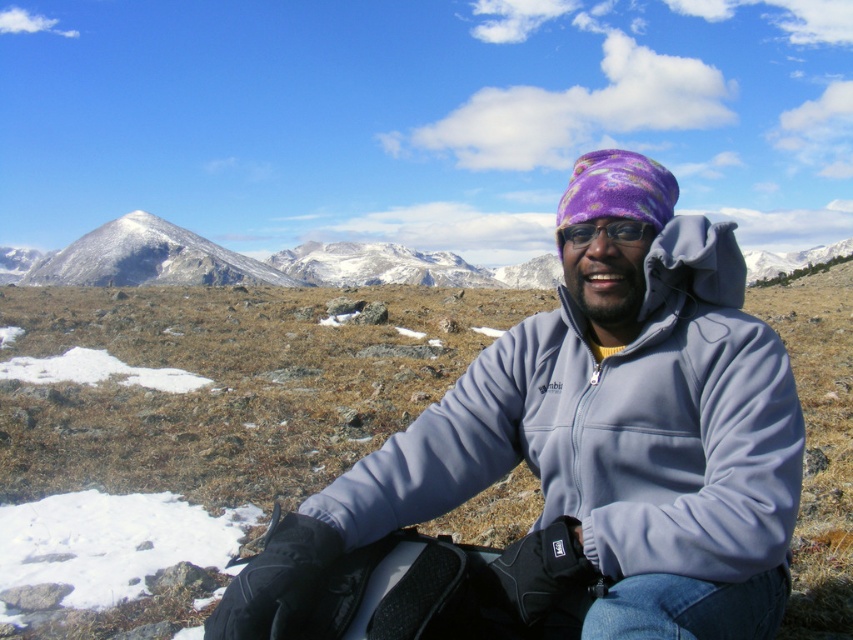
Where is `gray fleece jacket at center`? The height and width of the screenshot is (640, 853). gray fleece jacket at center is located at coordinates (614, 428).

Does gray fleece jacket at center have a greater width compared to purple fleece goggles at center?

Yes, gray fleece jacket at center is wider than purple fleece goggles at center.

Locate an element on the screen. The height and width of the screenshot is (640, 853). gray fleece jacket at center is located at coordinates (614, 428).

Between gray fleece jacket at center and snowy rock mountain at left, which one appears on the right side from the viewer's perspective?

gray fleece jacket at center is more to the right.

Which is behind, point (616, 426) or point (190, 240)?

Positioned behind is point (190, 240).

Where is `gray fleece jacket at center`? The image size is (853, 640). gray fleece jacket at center is located at coordinates (614, 428).

Between point (224, 256) and point (578, 225), which one is positioned in front?

Point (578, 225) is in front.

Who is taller, snowy rock mountain at left or purple fleece goggles at center?

snowy rock mountain at left is taller.

Does point (134, 260) come farther from viewer compared to point (573, 234)?

Yes, point (134, 260) is farther from viewer.

Locate an element on the screen. The width and height of the screenshot is (853, 640). snowy rock mountain at left is located at coordinates (148, 259).